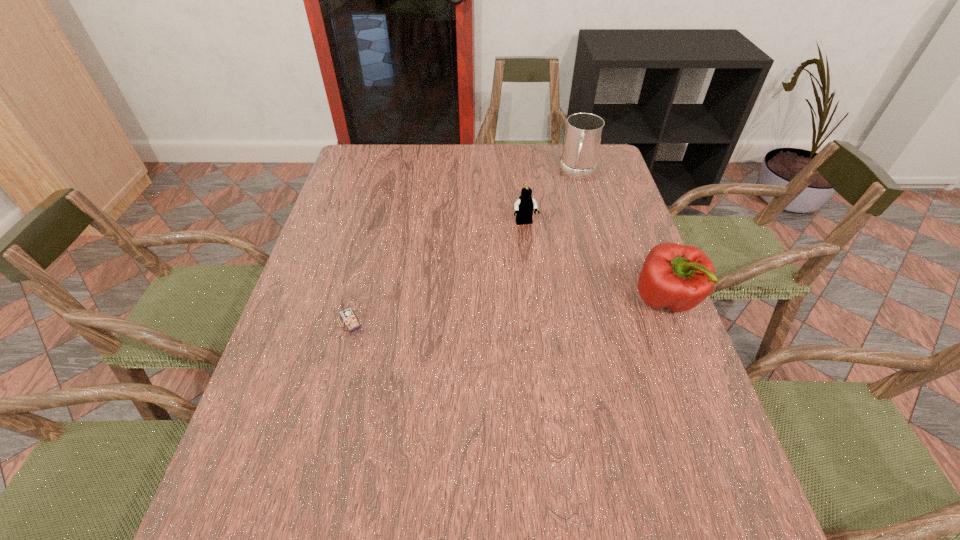
Where is `free space at the left edge of the desktop`? free space at the left edge of the desktop is located at coordinates (312, 318).

At what (x,y) coordinates should I click in order to perform the action: click on free space at the right edge. Please return your answer as a coordinate pair (x, y). This screenshot has height=540, width=960. Looking at the image, I should click on (612, 188).

Find the location of a particular element. Image resolution: width=960 pixels, height=540 pixels. free space at the far left corner of the desktop is located at coordinates (389, 147).

I want to click on vacant space in between the matchbox and the bell pepper, so click(x=508, y=310).

Find the location of a particular element. This screenshot has height=540, width=960. vacant space in between the second object from left to right and the matchbox is located at coordinates (438, 273).

Find the location of a particular element. The width and height of the screenshot is (960, 540). vacant area between the bell pepper and the leftmost object is located at coordinates (508, 310).

What are the coordinates of `free space between the matchbox and the third object from right to left` in the screenshot? It's located at (438, 273).

Identify the location of vacant space that is in between the bell pepper and the farthest object. The height and width of the screenshot is (540, 960). (622, 237).

Identify the location of vacant space that is in between the bell pepper and the mug. The height and width of the screenshot is (540, 960). (622, 237).

You are a GUI agent. You are given a task and a screenshot of the screen. Output one action in this format:
    pyautogui.click(x=<x>, y=<y>)
    Task: Click on the vacant space in between the Lego and the mug
    Image resolution: width=960 pixels, height=540 pixels.
    Given the screenshot: What is the action you would take?
    pyautogui.click(x=552, y=198)